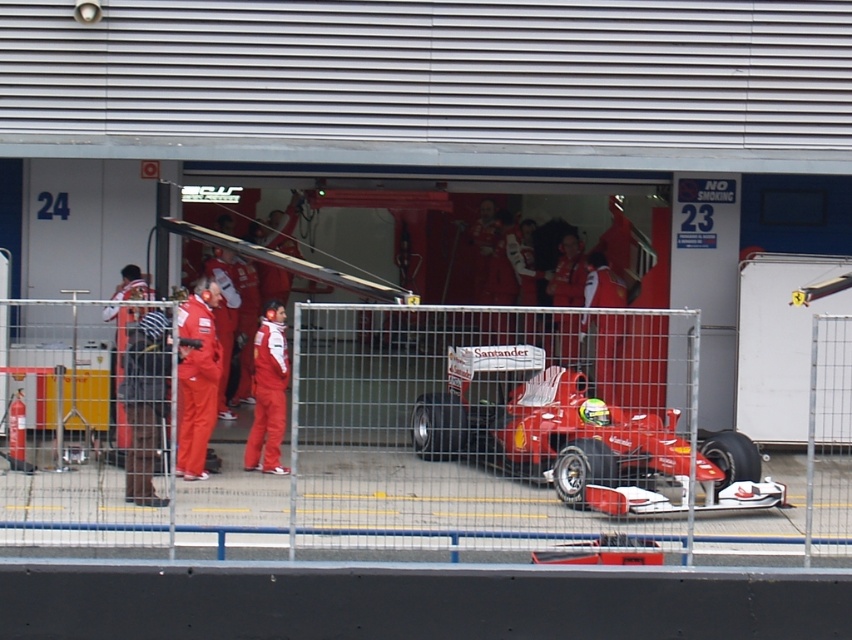
Is metal at center below shiny red race car at center?

No.

Is metal at center wider than shiny red race car at center?

Correct, the width of metal at center exceeds that of shiny red race car at center.

Is point (579, 465) behind point (675, 419)?

No, (579, 465) is in front of (675, 419).

Where is `metal at center`? Image resolution: width=852 pixels, height=640 pixels. metal at center is located at coordinates (432, 438).

Is metal at center to the right of red fabric suit at center from the viewer's perspective?

Yes, metal at center is to the right of red fabric suit at center.

Does metal at center appear over red fabric suit at center?

Incorrect, metal at center is not positioned above red fabric suit at center.

Who is more forward, (490, 448) or (206, 474)?

Point (206, 474)

Image resolution: width=852 pixels, height=640 pixels. In order to click on metal at center in this screenshot , I will do `click(432, 438)`.

Which of these two, shiny red race car at center or red fabric suit at center, stands taller?

Standing taller between the two is red fabric suit at center.

Is shiny red race car at center shorter than red fabric suit at center?

Yes, shiny red race car at center is shorter than red fabric suit at center.

Which is in front, point (440, 417) or point (183, 336)?

Positioned in front is point (183, 336).

Where is `shiny red race car at center`? shiny red race car at center is located at coordinates (548, 428).